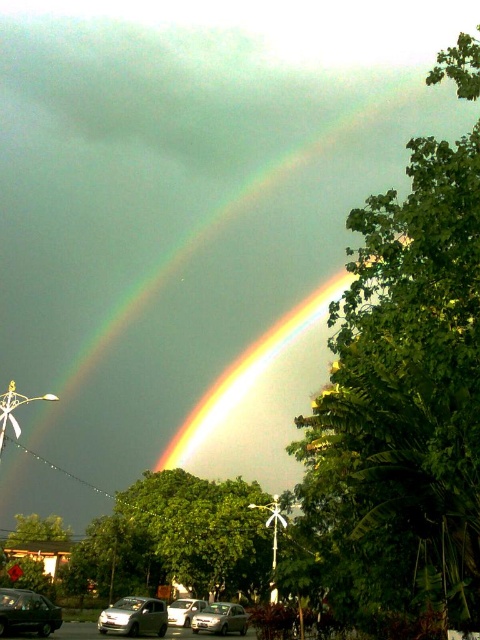
Between point (243, 627) and point (190, 612), which one is positioned behind?

Positioned behind is point (190, 612).

Does satin silver car at lower center have a greater width compared to silver metallic car at center?

Correct, the width of satin silver car at lower center exceeds that of silver metallic car at center.

Is point (228, 620) positioned in front of point (170, 618)?

Yes, point (228, 620) is in front of point (170, 618).

The image size is (480, 640). What are the coordinates of `satin silver car at lower center` in the screenshot? It's located at (220, 618).

Does rainbow at upper center lie in front of silver metallic car at lower left?

That is False.

Does point (167, 262) lie in front of point (112, 625)?

No, (167, 262) is further to viewer.

Locate an element on the screen. The width and height of the screenshot is (480, 640). rainbow at upper center is located at coordinates (171, 268).

Can you confirm if silver metallic car at lower left is positioned to the left of satin silver car at lower center?

Correct, you'll find silver metallic car at lower left to the left of satin silver car at lower center.

Can you confirm if silver metallic car at lower left is smaller than satin silver car at lower center?

Indeed, silver metallic car at lower left has a smaller size compared to satin silver car at lower center.

Find the location of a particular element. silver metallic car at lower left is located at coordinates (134, 616).

The width and height of the screenshot is (480, 640). I want to click on silver metallic car at lower left, so click(x=134, y=616).